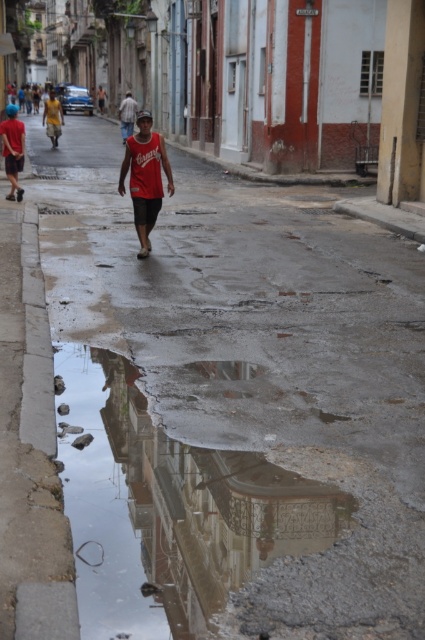
Which is more to the left, reflective concrete puddle at center or red cotton shirt at center?

red cotton shirt at center

This screenshot has height=640, width=425. What are the coordinates of `reflective concrete puddle at center` in the screenshot? It's located at (169, 509).

Which is below, reflective concrete puddle at center or matte red tank top at center?

reflective concrete puddle at center is lower down.

Is reflective concrete puddle at center behind matte red tank top at center?

No, it is in front of matte red tank top at center.

Which is behind, point (217, 468) or point (136, 212)?

Positioned behind is point (136, 212).

The width and height of the screenshot is (425, 640). Identify the location of reflective concrete puddle at center. (169, 509).

Does matte red tank top at center have a smaller size compared to red cotton shirt at center?

Actually, matte red tank top at center might be larger than red cotton shirt at center.

Does matte red tank top at center have a lesser height compared to red cotton shirt at center?

No, matte red tank top at center is not shorter than red cotton shirt at center.

Who is more forward, [164,168] or [135,102]?

Point [164,168]

This screenshot has height=640, width=425. Identify the location of matte red tank top at center. (144, 177).